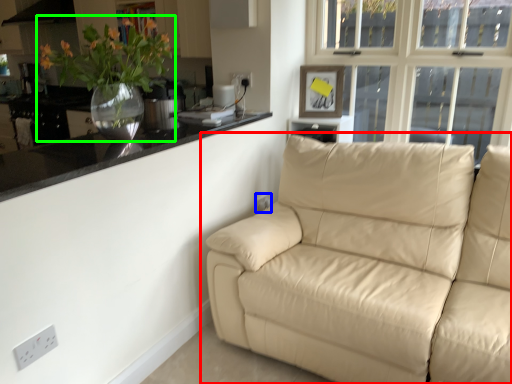
Question: Which object is positioned farthest from studio couch (highlighted by a red box)? Select from electric outlet (highlighted by a blue box) and houseplant (highlighted by a green box).

Choices:
 (A) electric outlet
 (B) houseplant

Answer: (B)